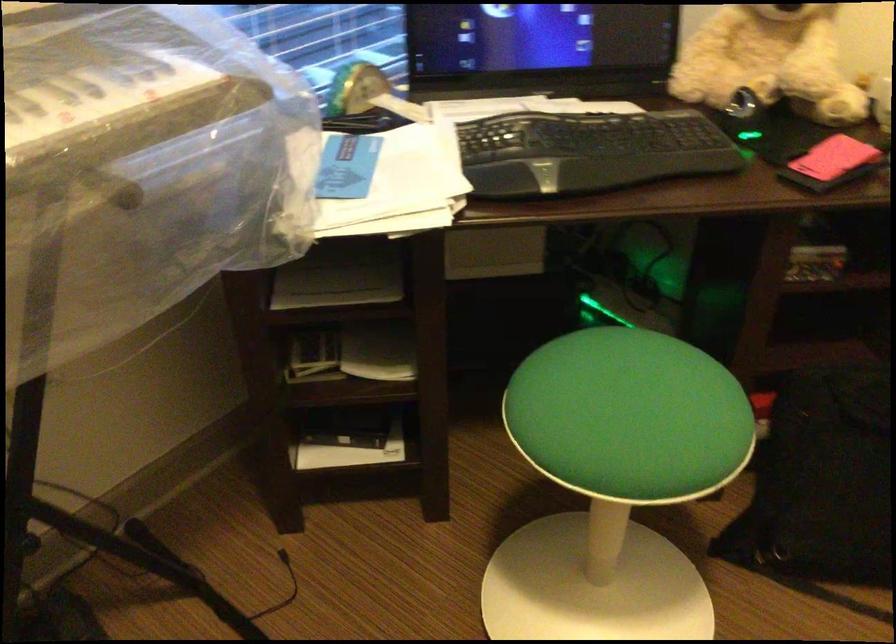
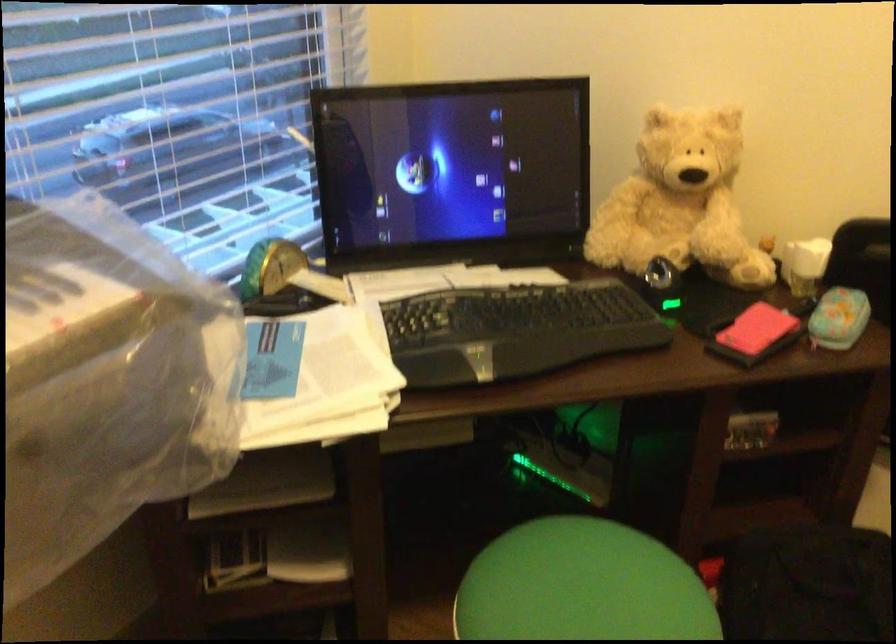
The images are taken continuously from a first-person perspective. In which direction are you moving?

The cameraman walked toward left, forward.